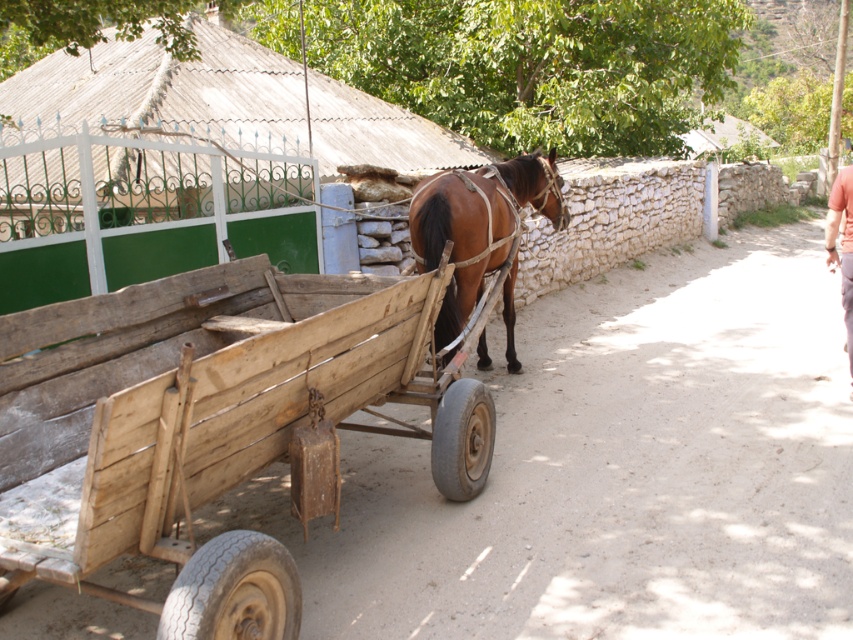
You are a delivery person standing at the lower right corner of the image. You need to hand over a package to someone near the brown glossy horse at center. Considering the distance between you and the pink fabric pants at lower right, can you throw the package to the person near the horse?

The distance between the brown glossy horse at center and the pink fabric pants at lower right is 10.37 feet. Since you are at the lower right near the pink fabric pants, the person near the horse is 10.37 feet away. Whether you can throw the package depends on your throwing ability, but the distance is about 10.37 feet.

You are a farmer who needs to load a bale of hay onto the wooden cart at center. The bale is as wide as the brown glossy horse at center. Will the bale fit on the cart?

The wooden cart at center is wider than the brown glossy horse at center, so the bale of hay, which is as wide as the horse, will fit on the cart.

You are a traveler standing at the edge of the dirt path. You see the wooden cart at center and the pink fabric pants at lower right. Which object is closer to the ground?

The wooden cart at center is closer to the ground because it is below the pink fabric pants at lower right.